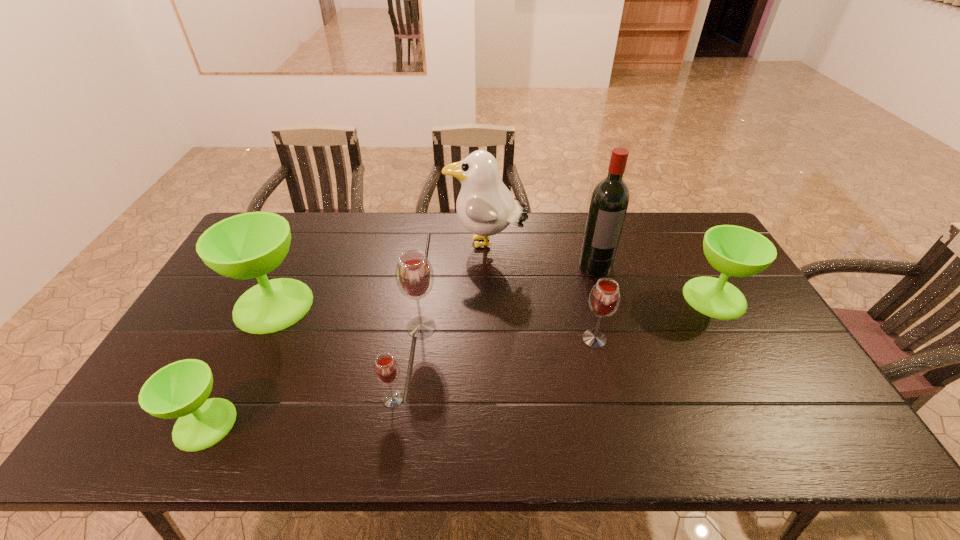
Identify the location of unoccupied position between the smallest green wineglass and the second smallest red wineglass. Image resolution: width=960 pixels, height=540 pixels. (399, 381).

Locate an element on the screen. Image resolution: width=960 pixels, height=540 pixels. vacant space in between the rightmost object and the smallest green wineglass is located at coordinates (460, 361).

Identify the location of free space between the second biggest red wineglass and the white gull. This screenshot has height=540, width=960. (540, 292).

Identify the location of free space between the smallest red wineglass and the biggest green wineglass. The height and width of the screenshot is (540, 960). (333, 352).

I want to click on vacant region between the nearest green wineglass and the smallest red wineglass, so click(299, 411).

Locate an element on the screen. This screenshot has height=540, width=960. blank region between the nearest red wineglass and the biggest green wineglass is located at coordinates (333, 352).

Image resolution: width=960 pixels, height=540 pixels. Identify the location of free space between the biggest red wineglass and the nearest red wineglass. (407, 363).

This screenshot has width=960, height=540. I want to click on vacant area that lies between the rightmost green wineglass and the second biggest red wineglass, so click(x=655, y=319).

This screenshot has width=960, height=540. Identify the location of empty space that is in between the red wine bottle and the biggest red wineglass. (509, 296).

Find the location of a particular element. The height and width of the screenshot is (540, 960). free space between the smallest green wineglass and the smallest red wineglass is located at coordinates (299, 411).